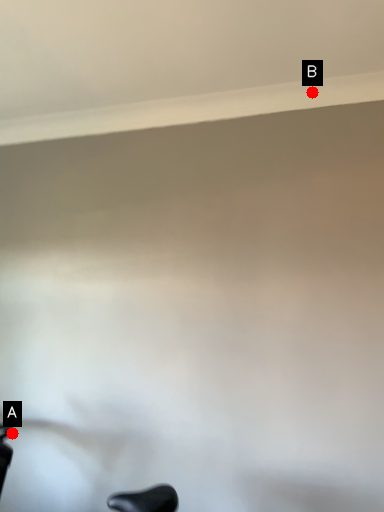
Question: Two points are circled on the image, labeled by A and B beside each circle. Which point is farther to the camera?

Choices:
 (A) A is further
 (B) B is further

Answer: (A)